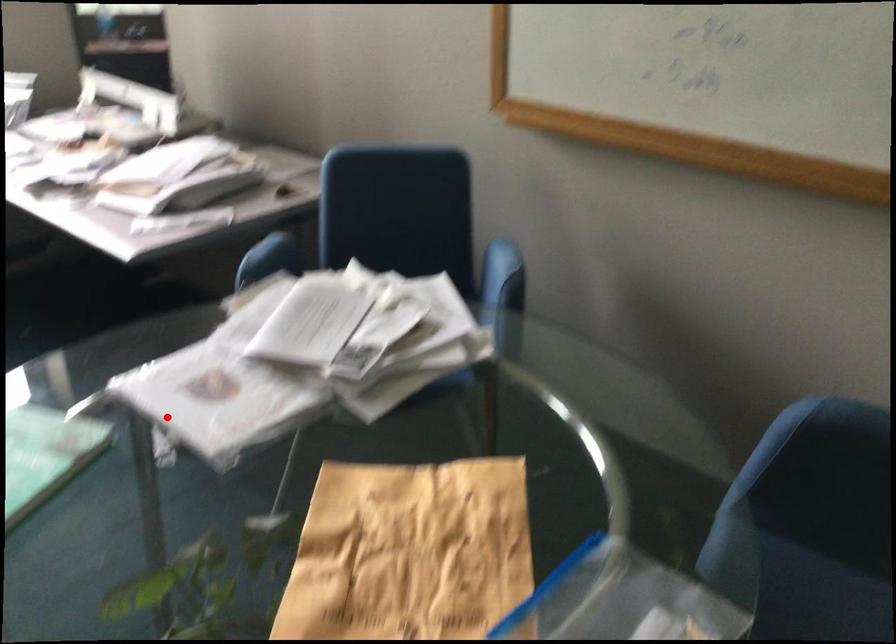
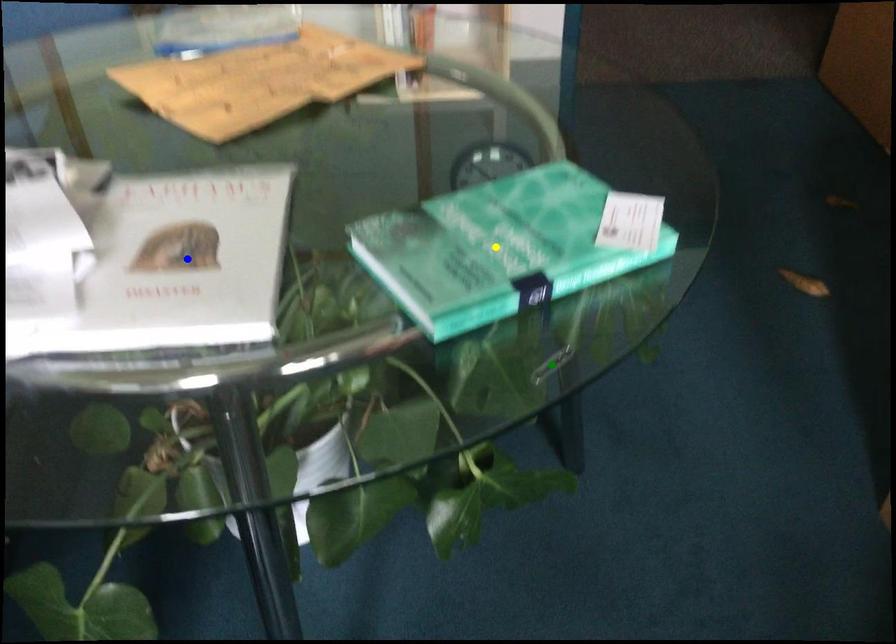
Question: I am providing you with two images of the same scene from different viewpoints. A red point is marked on the first image. You are given multiple points on the second image. Which point in image 2 represents the same 3d spot as the red point in image 1?

Choices:
 (A) blue point
 (B) green point
 (C) yellow point

Answer: (A)